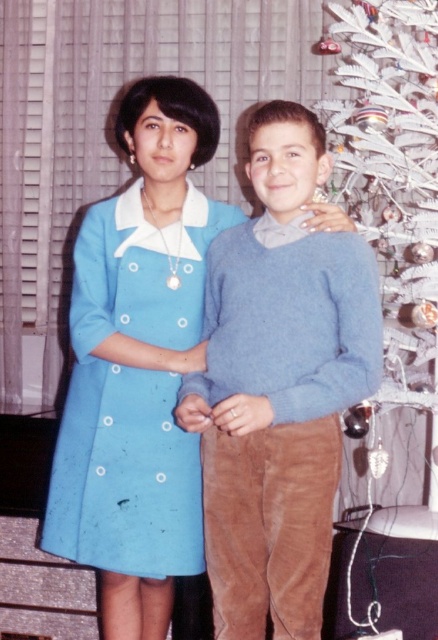
Between light blue sweater at center and matte blue dress at center, which one appears on the left side from the viewer's perspective?

matte blue dress at center

From the picture: Is light blue sweater at center positioned before matte blue dress at center?

Yes.

Who is more forward, [295,524] or [102,518]?

Point [295,524] is more forward.

Locate an element on the screen. light blue sweater at center is located at coordinates (279, 387).

Locate an element on the screen. The image size is (438, 640). matte blue dress at center is located at coordinates (130, 396).

Is matte blue dress at center smaller than white feather christmas tree at right?

Indeed, matte blue dress at center has a smaller size compared to white feather christmas tree at right.

Between point (131, 500) and point (392, 376), which one is positioned behind?

Point (392, 376)

Locate an element on the screen. Image resolution: width=438 pixels, height=640 pixels. matte blue dress at center is located at coordinates (130, 396).

How distant is light blue sweater at center from white feather christmas tree at right?

light blue sweater at center and white feather christmas tree at right are 23.30 inches apart from each other.

Between light blue sweater at center and white feather christmas tree at right, which one is positioned lower?

light blue sweater at center is lower down.

Where is `light blue sweater at center`? light blue sweater at center is located at coordinates (279, 387).